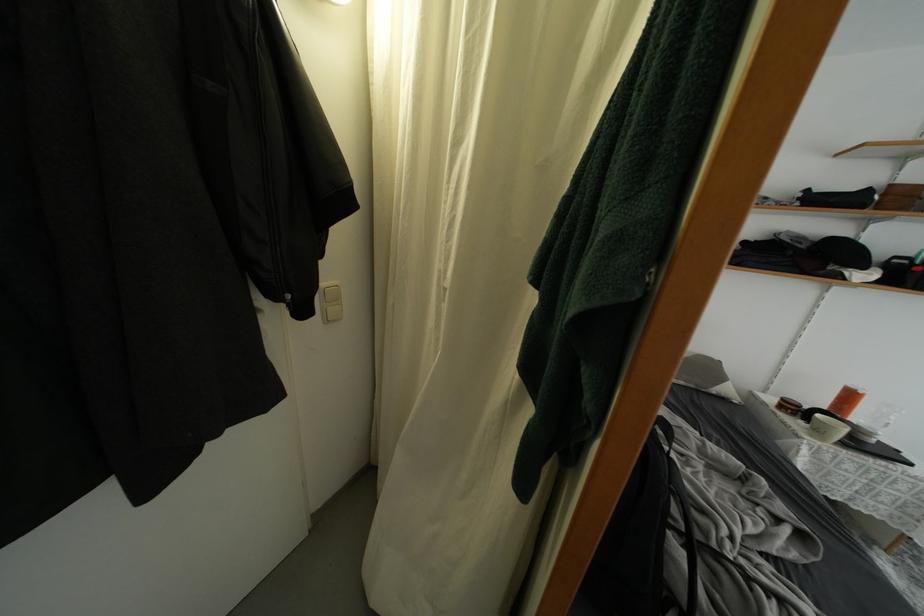
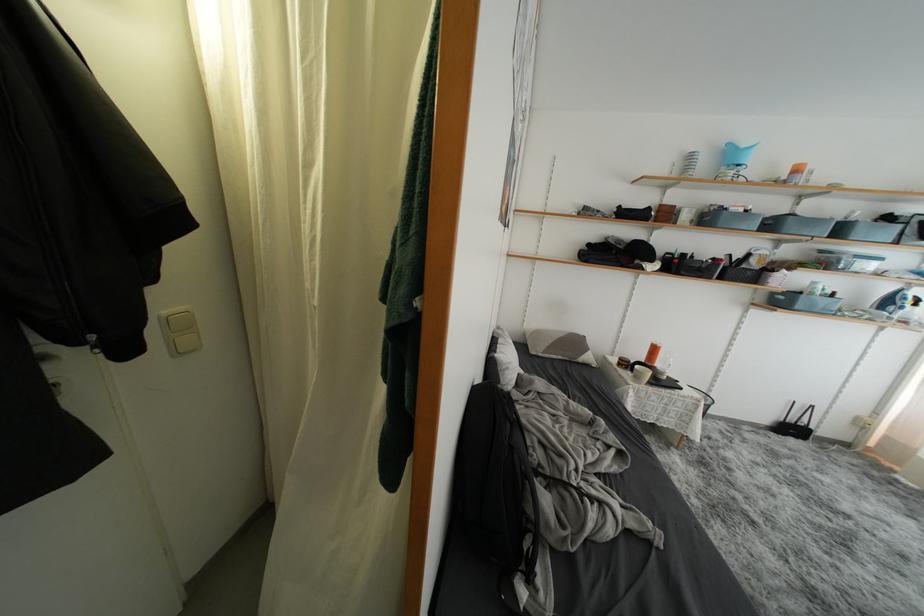
In the second image, find the point that corresponds to point (823, 437) in the first image.

(642, 382)